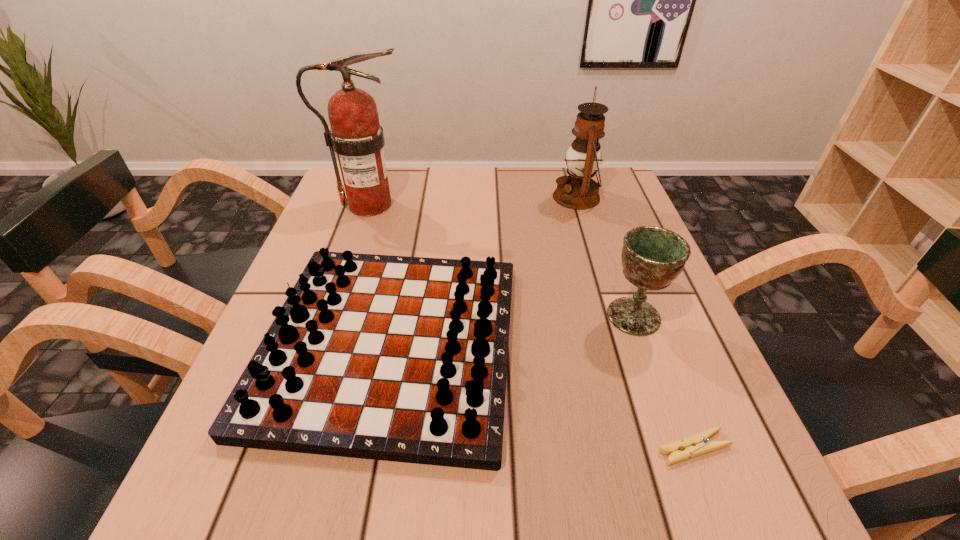
The image size is (960, 540). I want to click on free region located 0.250m on the right of the chessboard, so click(x=657, y=343).

Identify the location of vacant space located 0.220m on the back of the clothespin. (647, 322).

Find the location of `fire extinguisher that is at the far edge`. fire extinguisher that is at the far edge is located at coordinates (356, 136).

Locate an element on the screen. The image size is (960, 540). lantern positioned at the far edge is located at coordinates (578, 191).

Locate an element on the screen. chessboard at the near edge is located at coordinates (395, 358).

Identify the location of clothespin at the near edge. Image resolution: width=960 pixels, height=540 pixels. (698, 444).

What are the coordinates of `fire extinguisher at the left edge` in the screenshot? It's located at (356, 136).

At what (x,y) coordinates should I click in order to perform the action: click on chessboard that is at the left edge. Please return your answer as a coordinate pair (x, y). The height and width of the screenshot is (540, 960). Looking at the image, I should click on (395, 358).

The width and height of the screenshot is (960, 540). I want to click on lantern that is at the right edge, so click(x=578, y=191).

This screenshot has height=540, width=960. In order to click on chalice that is at the right edge in this screenshot , I will do `click(652, 257)`.